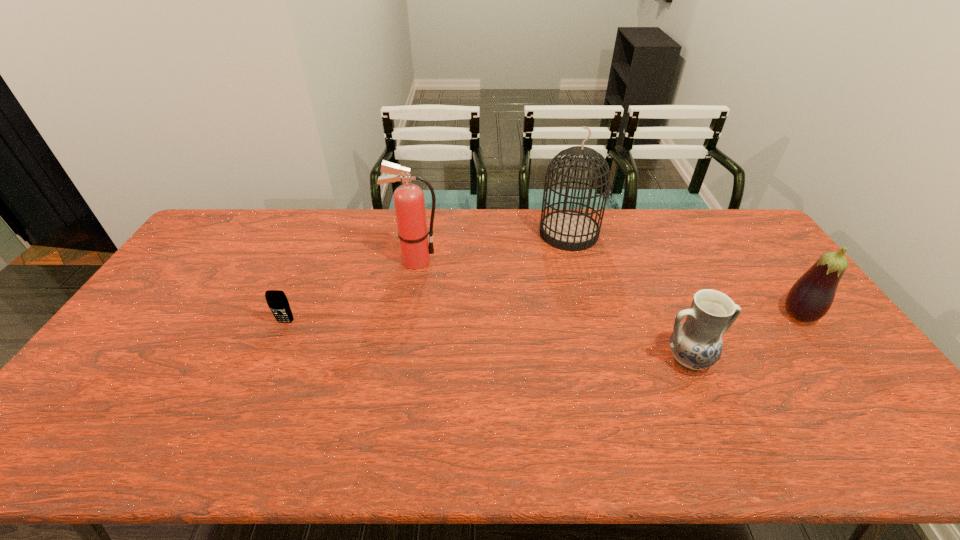
Identify the location of birdcage. (569, 230).

Locate an element on the screen. the farthest object is located at coordinates (569, 230).

Where is `fire extinguisher`? This screenshot has height=540, width=960. fire extinguisher is located at coordinates (409, 203).

Where is `the second farthest object`? The height and width of the screenshot is (540, 960). the second farthest object is located at coordinates (409, 203).

Find the location of a particular element. The width and height of the screenshot is (960, 540). the rightmost object is located at coordinates (810, 298).

Locate an element on the screen. The image size is (960, 540). the third shortest object is located at coordinates (810, 298).

The height and width of the screenshot is (540, 960). I want to click on the nearest object, so click(x=696, y=344).

The width and height of the screenshot is (960, 540). In order to click on the second shortest object in this screenshot , I will do `click(696, 344)`.

The image size is (960, 540). I want to click on cellular telephone, so click(x=277, y=301).

Image resolution: width=960 pixels, height=540 pixels. Identify the location of the leftmost object. (277, 301).